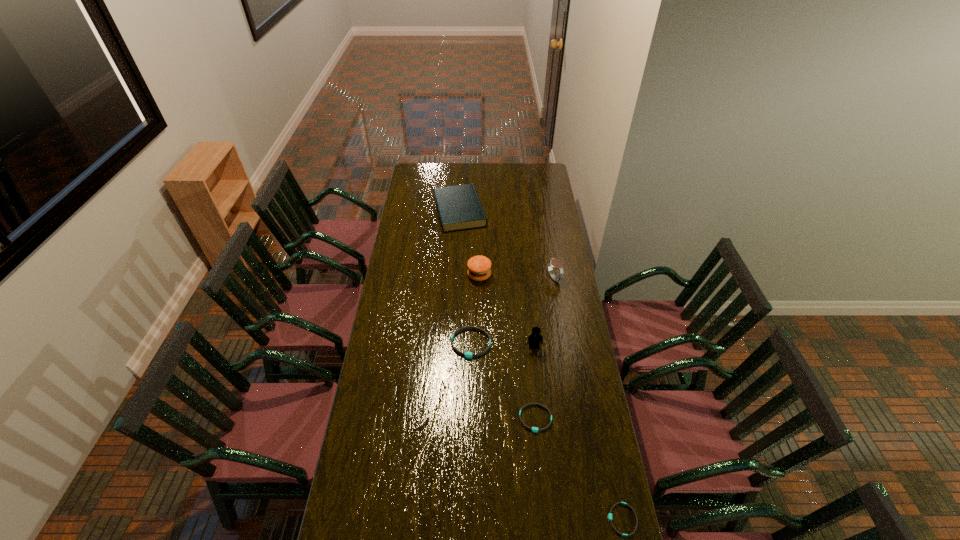
Where is `Lego`? Lego is located at coordinates (534, 339).

Identify the location of free space located 0.120m on the buckle of the third shortest object. The image size is (960, 540). (470, 384).

Locate an element on the screen. free space located 0.070m on the buckle of the second wristband from left to right is located at coordinates (539, 452).

You are a GUI agent. You are given a task and a screenshot of the screen. Output one action in this format:
    pyautogui.click(x=<x>, y=<y>)
    Task: Click on the free space located 0.390m on the buckle of the shortest wristband
    
    Given the screenshot: What is the action you would take?
    pyautogui.click(x=487, y=519)

Identify the location of vacant point located on the buckle of the shortest wristband. (534, 519).

Identify the location of vacant region located on the buckle of the shortest wristband. (586, 519).

Locate an element on the screen. vacant region located on the front of the patty is located at coordinates coord(479,303).

Where is `vacant space located 0.160m on the back of the farthest object`? This screenshot has width=960, height=540. vacant space located 0.160m on the back of the farthest object is located at coordinates (462, 177).

Image resolution: width=960 pixels, height=540 pixels. Find the location of `vacant space located on the front of the second object from right to left`. vacant space located on the front of the second object from right to left is located at coordinates (567, 354).

Locate an element on the screen. The height and width of the screenshot is (540, 960). vacant space located 0.130m on the front-facing side of the Lego is located at coordinates (538, 378).